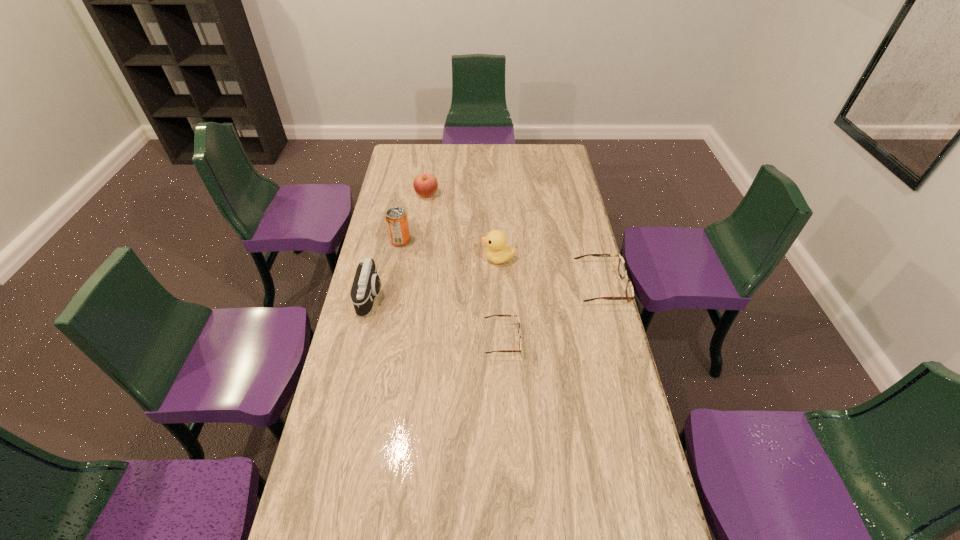
Locate an element on the screen. The height and width of the screenshot is (540, 960). vacant space at the far edge of the desktop is located at coordinates (464, 146).

Find the location of a particular element. vacant space at the near edge of the desktop is located at coordinates (393, 516).

The height and width of the screenshot is (540, 960). In the image, there is a desktop. In order to click on vacant space at the left edge in this screenshot , I will do `click(399, 202)`.

In the image, there is a desktop. In order to click on free space at the right edge in this screenshot , I will do [631, 458].

In order to click on vacant space at the far left corner in this screenshot , I will do `click(397, 157)`.

This screenshot has height=540, width=960. Identify the location of free space between the left spectacles and the taller spectacles. (552, 313).

The height and width of the screenshot is (540, 960). I want to click on empty location between the second shortest object and the camera, so click(x=486, y=292).

The width and height of the screenshot is (960, 540). I want to click on unoccupied position between the third shortest object and the nearest object, so click(x=465, y=267).

Locate an element on the screen. The height and width of the screenshot is (540, 960). empty space that is in between the taller spectacles and the camera is located at coordinates (486, 292).

This screenshot has width=960, height=540. I want to click on free space between the duck and the nearest object, so click(500, 299).